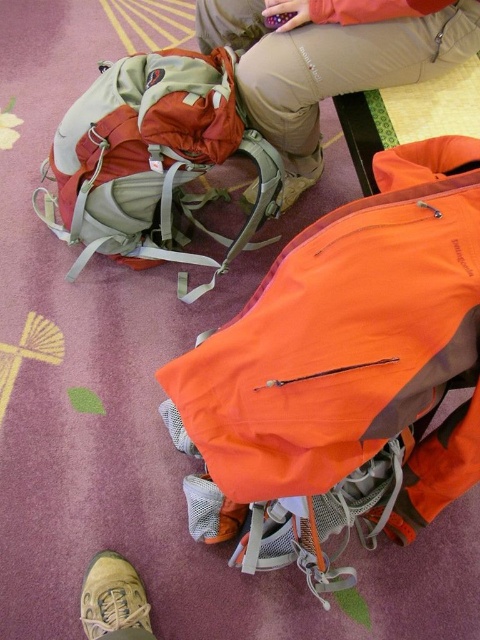
Between orange fabric backpack at center and matte green backpack at center, which one is positioned lower?

Positioned lower is orange fabric backpack at center.

This screenshot has height=640, width=480. Describe the element at coordinates (343, 372) in the screenshot. I see `orange fabric backpack at center` at that location.

Where is `orange fabric backpack at center`? The width and height of the screenshot is (480, 640). orange fabric backpack at center is located at coordinates (343, 372).

I want to click on orange fabric backpack at center, so click(343, 372).

Between orange fabric backpack at center and tan suede shoe at lower left, which one is positioned higher?

Positioned higher is orange fabric backpack at center.

What do you see at coordinates (343, 372) in the screenshot? The height and width of the screenshot is (640, 480). I see `orange fabric backpack at center` at bounding box center [343, 372].

Image resolution: width=480 pixels, height=640 pixels. In order to click on orange fabric backpack at center in this screenshot , I will do `click(343, 372)`.

Is orange fabric pants at center taller than tan suede shoe at lower left?

Yes.

Can you confirm if orange fabric pants at center is positioned to the left of tan suede shoe at lower left?

In fact, orange fabric pants at center is to the right of tan suede shoe at lower left.

This screenshot has height=640, width=480. What do you see at coordinates (331, 60) in the screenshot?
I see `orange fabric pants at center` at bounding box center [331, 60].

You are a GUI agent. You are given a task and a screenshot of the screen. Output one action in this format:
    pyautogui.click(x=<x>, y=<y>)
    Task: Click on the orange fabric pants at center
    
    Given the screenshot: What is the action you would take?
    pyautogui.click(x=331, y=60)